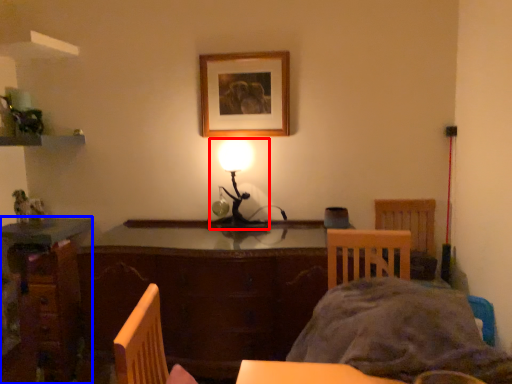
Question: Which point is closer to the camera, lamp (highlighted by a red box) or desk (highlighted by a blue box)?

Choices:
 (A) lamp
 (B) desk

Answer: (A)